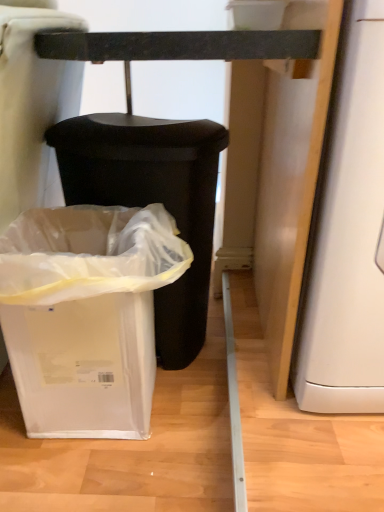
Based on the photo, what is the approximate height of white plastic waste container at lower left, arranged as the 1th waste container when viewed from the back?

white plastic waste container at lower left, arranged as the 1th waste container when viewed from the back, is 23.76 inches in height.

What do you see at coordinates (152, 201) in the screenshot? The width and height of the screenshot is (384, 512). I see `white plastic waste container at lower left, arranged as the 1th waste container when viewed from the back` at bounding box center [152, 201].

The width and height of the screenshot is (384, 512). In order to click on white plastic waste container at lower left, arranged as the 1th waste container when viewed from the back in this screenshot , I will do `click(152, 201)`.

At what (x,y) coordinates should I click in order to perform the action: click on white plastic waste container at lower left, the 1th waste container in the front-to-back sequence. Please return your answer as a coordinate pair (x, y). Looking at the image, I should click on pyautogui.click(x=86, y=315).

Image resolution: width=384 pixels, height=512 pixels. What do you see at coordinates (86, 315) in the screenshot?
I see `white plastic waste container at lower left, the 2th waste container viewed from the back` at bounding box center [86, 315].

Locate an element on the screen. This screenshot has height=512, width=384. white plastic waste container at lower left, arranged as the 1th waste container when viewed from the back is located at coordinates (152, 201).

Which object is positioned more to the right, white plastic waste container at lower left, the 2th waste container viewed from the back, or white plastic waste container at lower left, arranged as the 2th waste container when viewed from the front?

Positioned to the right is white plastic waste container at lower left, arranged as the 2th waste container when viewed from the front.

In the image, is white plastic waste container at lower left, the 2th waste container viewed from the back, positioned in front of or behind white plastic waste container at lower left, arranged as the 1th waste container when viewed from the back?

Visually, white plastic waste container at lower left, the 2th waste container viewed from the back, is located in front of white plastic waste container at lower left, arranged as the 1th waste container when viewed from the back.

Which is in front, point (97, 426) or point (64, 176)?

The point (97, 426) is more forward.

From the image's perspective, is white plastic waste container at lower left, the 2th waste container viewed from the back, above or below white plastic waste container at lower left, arranged as the 1th waste container when viewed from the back?

From the image's perspective, white plastic waste container at lower left, the 2th waste container viewed from the back, appears below white plastic waste container at lower left, arranged as the 1th waste container when viewed from the back.

From a real-world perspective, which object stands above the other?

white plastic waste container at lower left, arranged as the 1th waste container when viewed from the back.

Which of these two, white plastic waste container at lower left, the 2th waste container viewed from the back, or white plastic waste container at lower left, arranged as the 1th waste container when viewed from the back, is wider?

Wider between the two is white plastic waste container at lower left, arranged as the 1th waste container when viewed from the back.

Considering the sizes of objects white plastic waste container at lower left, the 2th waste container viewed from the back, and white plastic waste container at lower left, arranged as the 2th waste container when viewed from the front, in the image provided, who is taller, white plastic waste container at lower left, the 2th waste container viewed from the back, or white plastic waste container at lower left, arranged as the 2th waste container when viewed from the front,?

Standing taller between the two is white plastic waste container at lower left, arranged as the 2th waste container when viewed from the front.

Considering the relative sizes of white plastic waste container at lower left, the 2th waste container viewed from the back, and white plastic waste container at lower left, arranged as the 2th waste container when viewed from the front, in the image provided, is white plastic waste container at lower left, the 2th waste container viewed from the back, smaller than white plastic waste container at lower left, arranged as the 2th waste container when viewed from the front,?

Yes.

Can white plastic waste container at lower left, arranged as the 2th waste container when viewed from the front, be found inside white plastic waste container at lower left, the 2th waste container viewed from the back?

No, white plastic waste container at lower left, arranged as the 2th waste container when viewed from the front, is located outside of white plastic waste container at lower left, the 2th waste container viewed from the back.

Is white plastic waste container at lower left, the 1th waste container in the front-to-back sequence, positioned far away from white plastic waste container at lower left, arranged as the 1th waste container when viewed from the back?

No.

Is white plastic waste container at lower left, the 2th waste container viewed from the back, turned away from white plastic waste container at lower left, arranged as the 2th waste container when viewed from the front?

That's not correct — white plastic waste container at lower left, the 2th waste container viewed from the back, is not looking away from white plastic waste container at lower left, arranged as the 2th waste container when viewed from the front.

From the picture: How many degrees apart are the facing directions of white plastic waste container at lower left, the 1th waste container in the front-to-back sequence, and white plastic waste container at lower left, arranged as the 1th waste container when viewed from the back?

The angle between the facing direction of white plastic waste container at lower left, the 1th waste container in the front-to-back sequence, and the facing direction of white plastic waste container at lower left, arranged as the 1th waste container when viewed from the back, is 0.0014 degrees.

Where is `waste container lying on the left of white plastic waste container at lower left, arranged as the 2th waste container when viewed from the front`? This screenshot has height=512, width=384. waste container lying on the left of white plastic waste container at lower left, arranged as the 2th waste container when viewed from the front is located at coordinates (86, 315).

Which object is positioned more to the left, white plastic waste container at lower left, arranged as the 2th waste container when viewed from the front, or white plastic waste container at lower left, the 2th waste container viewed from the back?

Positioned to the left is white plastic waste container at lower left, the 2th waste container viewed from the back.

Which is behind, white plastic waste container at lower left, arranged as the 2th waste container when viewed from the front, or white plastic waste container at lower left, the 1th waste container in the front-to-back sequence?

white plastic waste container at lower left, arranged as the 2th waste container when viewed from the front, is behind.

Which is in front, point (195, 220) or point (16, 375)?

The point (16, 375) is in front.

From the image's perspective, would you say white plastic waste container at lower left, arranged as the 1th waste container when viewed from the back, is positioned over white plastic waste container at lower left, the 2th waste container viewed from the back?

Yes.

From a real-world perspective, is white plastic waste container at lower left, arranged as the 2th waste container when viewed from the front, under white plastic waste container at lower left, the 1th waste container in the front-to-back sequence?

No, from a real-world perspective, white plastic waste container at lower left, arranged as the 2th waste container when viewed from the front, is not under white plastic waste container at lower left, the 1th waste container in the front-to-back sequence.

Which of these two, white plastic waste container at lower left, arranged as the 2th waste container when viewed from the front, or white plastic waste container at lower left, the 1th waste container in the front-to-back sequence, is wider?

white plastic waste container at lower left, arranged as the 2th waste container when viewed from the front, is wider.

Is white plastic waste container at lower left, arranged as the 1th waste container when viewed from the back, taller than white plastic waste container at lower left, the 1th waste container in the front-to-back sequence?

Correct, white plastic waste container at lower left, arranged as the 1th waste container when viewed from the back, is much taller as white plastic waste container at lower left, the 1th waste container in the front-to-back sequence.

Between white plastic waste container at lower left, arranged as the 1th waste container when viewed from the back, and white plastic waste container at lower left, the 2th waste container viewed from the back, which one has larger size?

white plastic waste container at lower left, arranged as the 1th waste container when viewed from the back.

Is white plastic waste container at lower left, arranged as the 2th waste container when viewed from the front, located outside white plastic waste container at lower left, the 1th waste container in the front-to-back sequence?

white plastic waste container at lower left, arranged as the 2th waste container when viewed from the front, lies outside white plastic waste container at lower left, the 1th waste container in the front-to-back sequence,'s area.

Is the surface of white plastic waste container at lower left, arranged as the 2th waste container when viewed from the front, in direct contact with white plastic waste container at lower left, the 1th waste container in the front-to-back sequence?

No, white plastic waste container at lower left, arranged as the 2th waste container when viewed from the front, is not touching white plastic waste container at lower left, the 1th waste container in the front-to-back sequence.

Is white plastic waste container at lower left, arranged as the 2th waste container when viewed from the front, turned away from white plastic waste container at lower left, the 2th waste container viewed from the back?

No.

The image size is (384, 512). In order to click on waste container behind the white plastic waste container at lower left, the 1th waste container in the front-to-back sequence in this screenshot , I will do `click(152, 201)`.

At what (x,y) coordinates should I click in order to perform the action: click on waste container lying above the white plastic waste container at lower left, the 2th waste container viewed from the back (from the image's perspective). Please return your answer as a coordinate pair (x, y). The height and width of the screenshot is (512, 384). Looking at the image, I should click on (152, 201).

Identify the location of waste container lying behind the white plastic waste container at lower left, the 1th waste container in the front-to-back sequence. (152, 201).